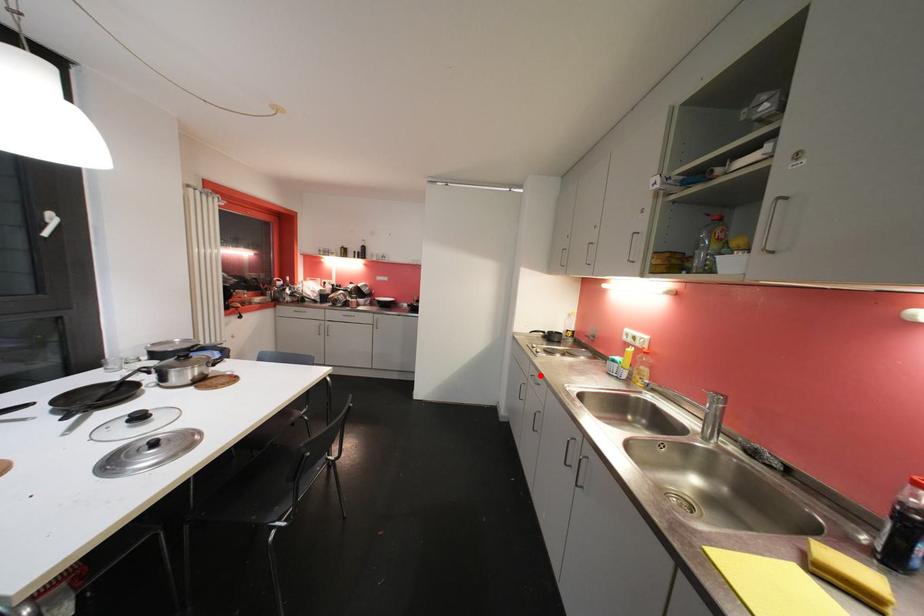
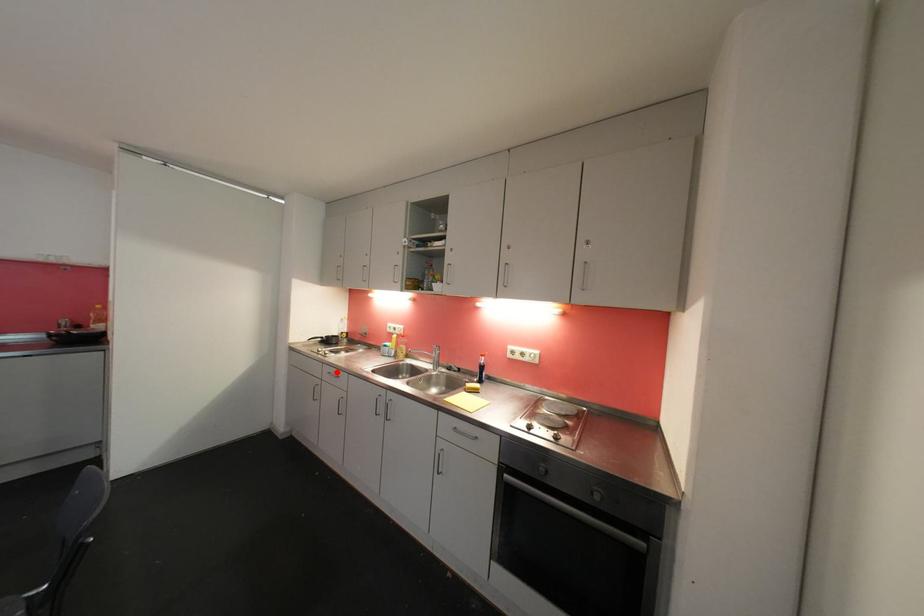
In the scene shown: I am providing you with two images of the same scene from different viewpoints. A red point is marked on the first image and another point is marked on the second image. Is the red point in image1 aligned with the point shown in image2?

Yes